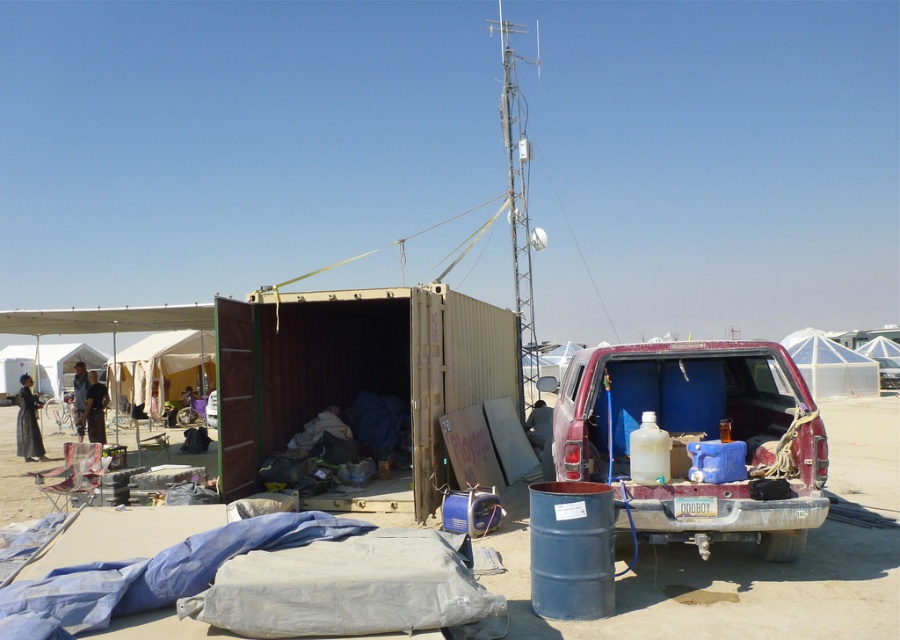
Question: Which object appears closest to the camera in this image?

Choices:
 (A) rustic wood van at rear
 (B) dark brown fabric at left

Answer: (A)

Question: Does dirt field at lower center have a larger size compared to dark brown fabric at center?

Choices:
 (A) no
 (B) yes

Answer: (B)

Question: Is the position of white canvas tent at lower left less distant than that of dark brown fabric at left?

Choices:
 (A) no
 (B) yes

Answer: (A)

Question: Which point is farther from the camera taking this photo?

Choices:
 (A) (84, 384)
 (B) (22, 397)

Answer: (A)

Question: Based on their relative distances, which object is farther from the dark brown fabric at center?

Choices:
 (A) white canvas tent at lower left
 (B) white canvas tent at center
 (C) dark brown fabric at left
 (D) transparent dome at upper right

Answer: (A)

Question: Does dark brown fabric at left have a smaller size compared to dark gray fabric at center?

Choices:
 (A) no
 (B) yes

Answer: (A)